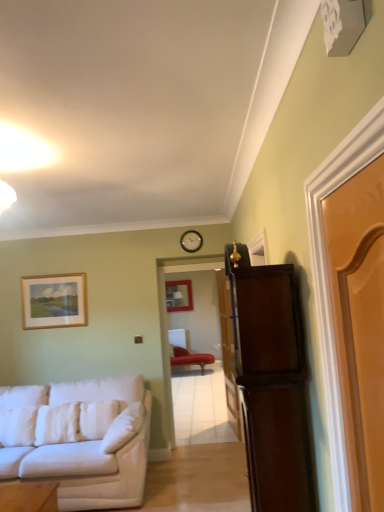
Question: Visually, is dark wood cabinet at right positioned to the left or to the right of white soft pillow at lower left, which ranks as the first pillow in left-to-right order?

Choices:
 (A) right
 (B) left

Answer: (A)

Question: Looking at the image, does dark wood cabinet at right seem bigger or smaller compared to white soft pillow at lower left, arranged as the third pillow when viewed from the right?

Choices:
 (A) big
 (B) small

Answer: (A)

Question: Based on their relative distances, which object is nearer to the white soft pillow at lower left, the third pillow positioned from the left?

Choices:
 (A) wooden door at center, which is the 2th door in back-to-front order
 (B) matte wooden picture frame at center, which is the second picture frame in left-to-right order
 (C) light brown wooden door at right, arranged as the third door when viewed from the back
 (D) velvet red chaise at center
 (E) white fabric couch at left

Answer: (E)

Question: Considering the real-world distances, which object is farthest from the wooden picture frame at upper left, which appears as the 1th picture frame when viewed from the front?

Choices:
 (A) wooden door at center, which ranks as the 2th door in front-to-back order
 (B) velvet red chaise at center
 (C) white soft pillow at lower left, positioned as the second pillow in left-to-right order
 (D) white fabric couch at left
 (E) dark wood cabinet at right

Answer: (B)